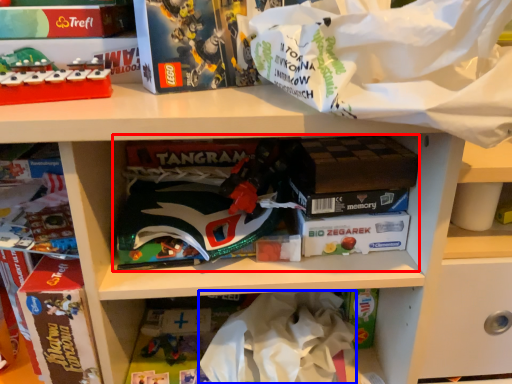
Question: Which object appears closest to the camera in this image, book (highlighted by a red box) or clothing (highlighted by a blue box)?

Choices:
 (A) book
 (B) clothing

Answer: (A)